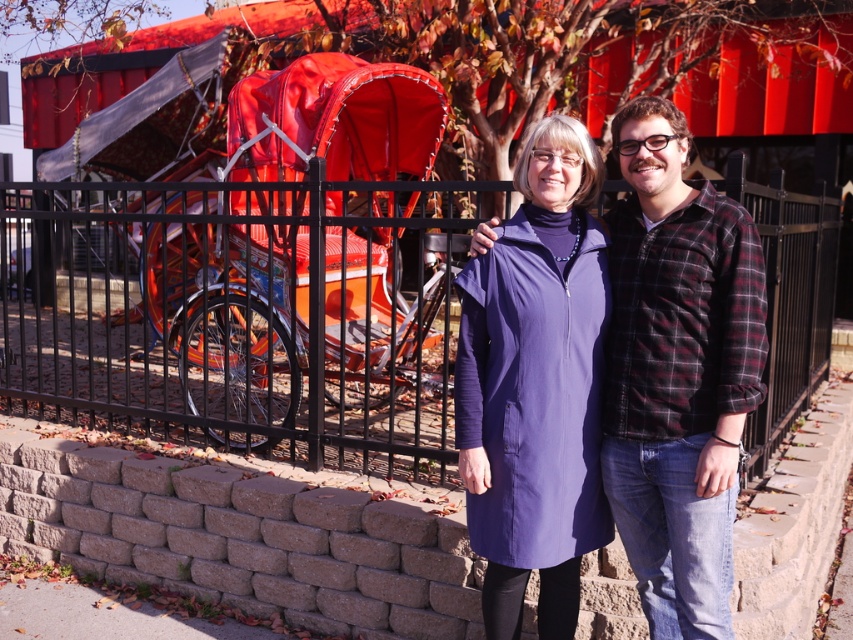
You are a photographer wanting to capture the purple matte coat at center without the black metal fence at center appearing in the shot. Is this possible given their positions?

The black metal fence at center is above the purple matte coat at center, so if you lower your camera angle to focus on the lower area where the purple matte coat at center is located, you can exclude the black metal fence at center from the frame.

You are standing in front of the decorative red carriage and notice the black metal fence at center and the purple smooth coat at center. Which object is positioned higher in the scene?

The black metal fence at center is positioned higher than the purple smooth coat at center in the scene.

You are a photographer trying to capture both the purple matte coat at center and the purple smooth coat at center in a single shot. Since they are both at the center, which one is on the right side when viewed from your perspective?

The purple matte coat at center is positioned on the right side of purple smooth coat at center, so when viewed from your perspective, the purple matte coat at center is on the right side.